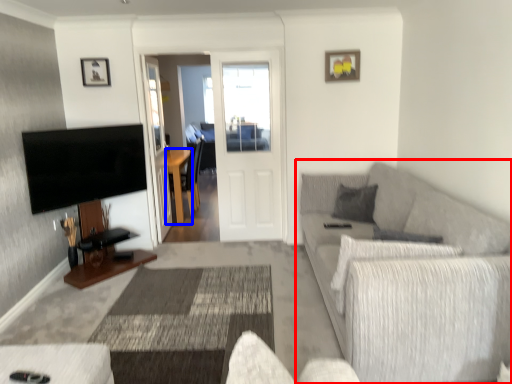
Question: Which of the following is the farthest to the observer, studio couch (highlighted by a red box) or table (highlighted by a blue box)?

Choices:
 (A) studio couch
 (B) table

Answer: (B)